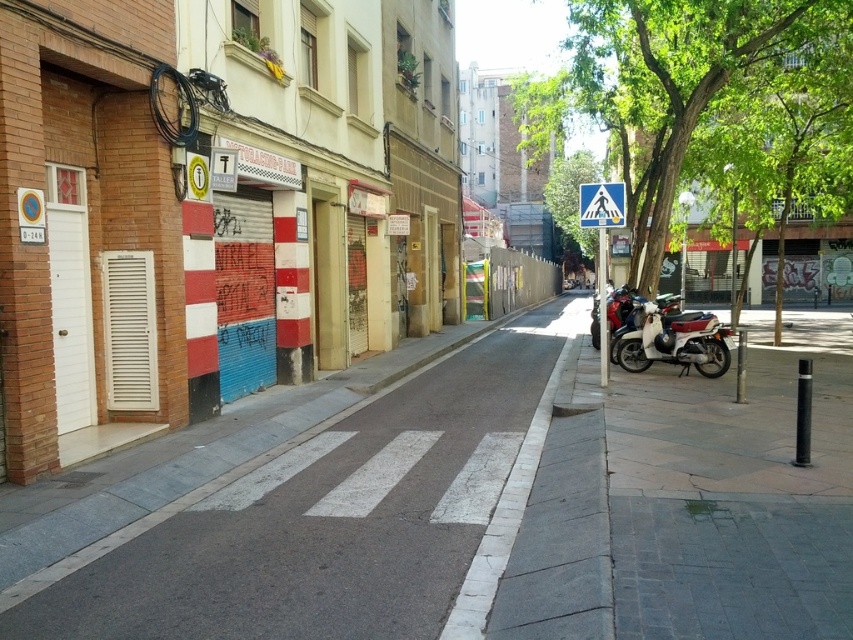
You are a delivery person needing to park your metallic blue scooter at right near the sidewalk. The parking area is located at coordinates point (x=674, y=340). Can you confirm if the scooter is already parked at the designated spot?

The point (x=674, y=340) marks the metallic blue scooter at right, so yes, the scooter is already parked at the designated spot.